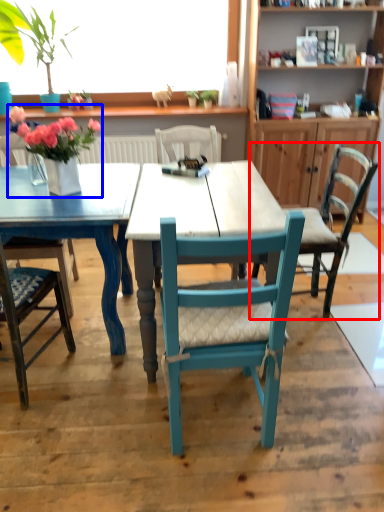
Question: Which of the following is the farthest to the observer, chair (highlighted by a red box) or floral arrangement (highlighted by a blue box)?

Choices:
 (A) chair
 (B) floral arrangement

Answer: (A)